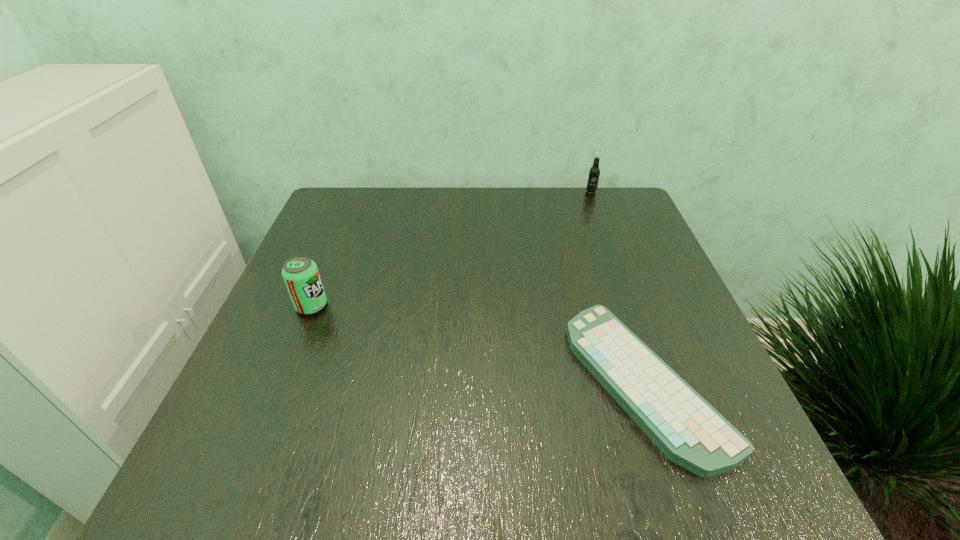
Identify the location of free spot that satisfies the following two spatial constraints: 1. on the front-facing side of the leftmost object; 2. on the right side of the computer keyboard. The image size is (960, 540). (280, 381).

Find the location of a particular element. The height and width of the screenshot is (540, 960). vacant area that satisfies the following two spatial constraints: 1. on the front-facing side of the computer keyboard; 2. on the left side of the pop soda is located at coordinates (280, 381).

In order to click on vacant region that satisfies the following two spatial constraints: 1. on the back side of the shortest object; 2. on the front-facing side of the pop soda in this screenshot , I will do `click(619, 306)`.

This screenshot has width=960, height=540. Find the location of `free space that satisfies the following two spatial constraints: 1. on the label of the root beer; 2. on the front-facing side of the pop soda`. free space that satisfies the following two spatial constraints: 1. on the label of the root beer; 2. on the front-facing side of the pop soda is located at coordinates (634, 306).

Image resolution: width=960 pixels, height=540 pixels. What are the coordinates of `vacant space that satisfies the following two spatial constraints: 1. on the front-facing side of the leftmost object; 2. on the back side of the shortest object` in the screenshot? It's located at (280, 381).

You are a GUI agent. You are given a task and a screenshot of the screen. Output one action in this format:
    pyautogui.click(x=<x>, y=<y>)
    Task: Click on the free space that satisfies the following two spatial constraints: 1. on the label of the root beer; 2. on the front-facing side of the leftmost object
    The height and width of the screenshot is (540, 960).
    Given the screenshot: What is the action you would take?
    pyautogui.click(x=634, y=306)

The width and height of the screenshot is (960, 540). I want to click on vacant space that satisfies the following two spatial constraints: 1. on the front-facing side of the pop soda; 2. on the back side of the shortest object, so click(280, 381).

Where is `free point that satisfies the following two spatial constraints: 1. on the label of the farthest object; 2. on the front-facing side of the leftmost object`? The width and height of the screenshot is (960, 540). free point that satisfies the following two spatial constraints: 1. on the label of the farthest object; 2. on the front-facing side of the leftmost object is located at coordinates (634, 306).

I want to click on free space in the image that satisfies the following two spatial constraints: 1. on the front-facing side of the shortest object; 2. on the right side of the leftmost object, so click(x=280, y=381).

At what (x,y) coordinates should I click in order to perform the action: click on vacant space that satisfies the following two spatial constraints: 1. on the front-facing side of the computer keyboard; 2. on the left side of the pop soda. Please return your answer as a coordinate pair (x, y). The height and width of the screenshot is (540, 960). Looking at the image, I should click on (280, 381).